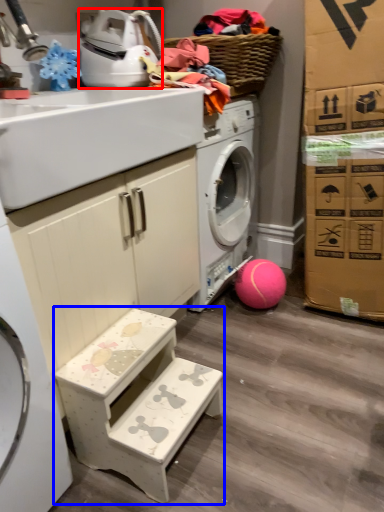
Question: Which point is closer to the camera, appliance (highlighted by a red box) or step stool (highlighted by a blue box)?

Choices:
 (A) appliance
 (B) step stool

Answer: (B)